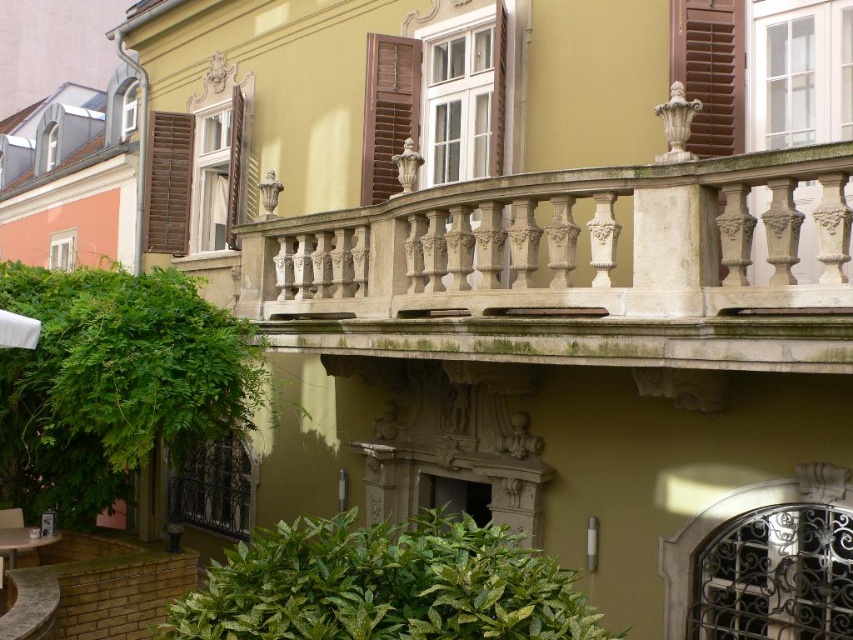
Question: Which point is closer to the camera?

Choices:
 (A) white stone railing at upper center
 (B) brown wooden shutter at left
 (C) brown wooden shutter at upper center
 (D) white fabric umbrella at lower left

Answer: (A)

Question: Does white stone railing at upper center have a smaller size compared to wooden at upper left?

Choices:
 (A) yes
 (B) no

Answer: (B)

Question: Estimate the real-world distances between objects in this image. Which object is closer to the brown wooden shutter at left?

Choices:
 (A) white stone railing at upper center
 (B) white fabric umbrella at lower left
 (C) wooden at upper left

Answer: (C)

Question: Which point appears closest to the camera in this image?

Choices:
 (A) (151, 232)
 (B) (15, 316)

Answer: (B)

Question: Can you confirm if white stone railing at upper center is positioned to the left of white fabric umbrella at lower left?

Choices:
 (A) no
 (B) yes

Answer: (A)

Question: Is brown wooden shutter at upper center to the left of brown wooden shutter at left from the viewer's perspective?

Choices:
 (A) yes
 (B) no

Answer: (B)